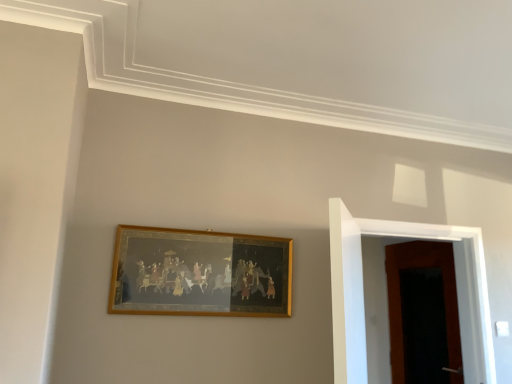
Question: In terms of size, does wooden door at right, positioned as the first door in back-to-front order, appear bigger or smaller than gold-framed painting at center?

Choices:
 (A) small
 (B) big

Answer: (B)

Question: From a real-world perspective, is wooden door at right, positioned as the first door in back-to-front order, positioned above or below gold-framed painting at center?

Choices:
 (A) above
 (B) below

Answer: (B)

Question: Considering the real-world distances, which object is farthest from the wooden door at right, which is the second door in back-to-front order?

Choices:
 (A) wooden door at right, which appears as the 2th door when viewed from the front
 (B) gold-framed painting at center

Answer: (A)

Question: Considering the real-world distances, which object is farthest from the gold-framed painting at center?

Choices:
 (A) wooden door at right, which is the second door in back-to-front order
 (B) wooden door at right, which appears as the 2th door when viewed from the front

Answer: (B)